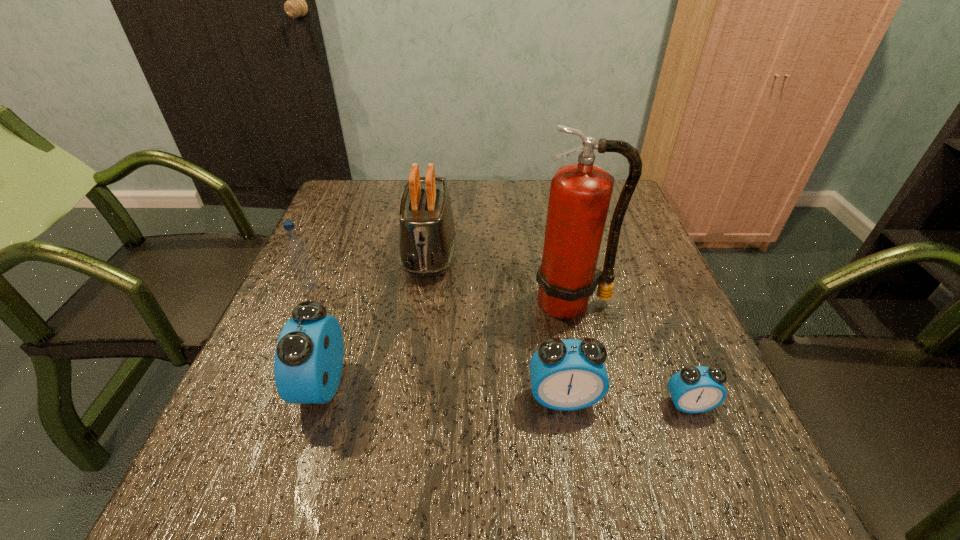
The height and width of the screenshot is (540, 960). I want to click on free space for an extra alarm_clock to achieve even spacing, so click(442, 392).